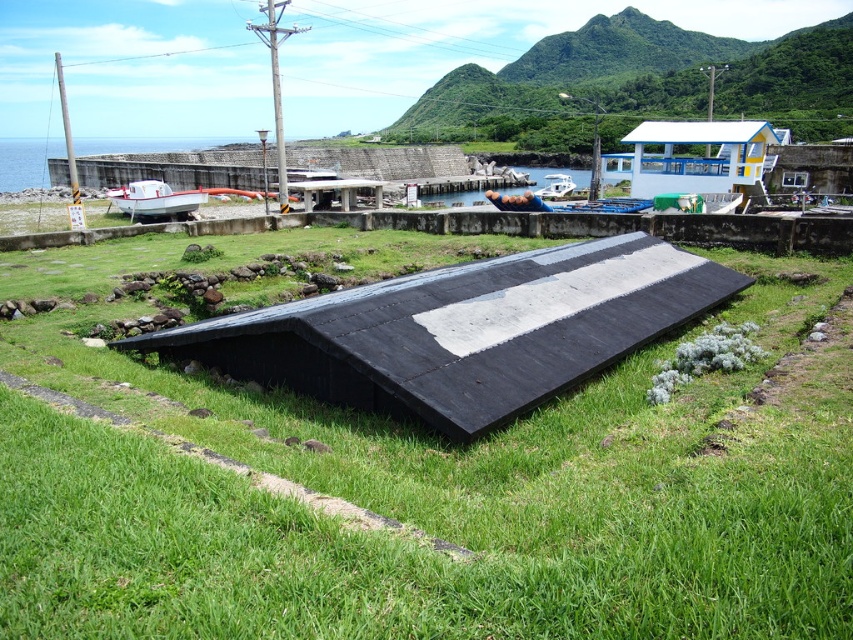
What object is located at the coordinates point (155, 200) in the image?

The point (155, 200) indicates the white matte boat at center.

You are a delivery drone that needs to land on the platform. You see the green grass at center and the white matte boat at center. Which one is on the left side so you can avoid it while landing?

The white matte boat at center is on the left side of the green grass at center, so you should avoid it by landing on the right side.

You are standing on the black rectangular platform and want to walk to the white matte boat at center. Which direction should you move relative to the green grass at center?

Since the green grass at center is closer to the viewer than the white matte boat at center, you should move away from the green grass at center to reach the white matte boat at center.